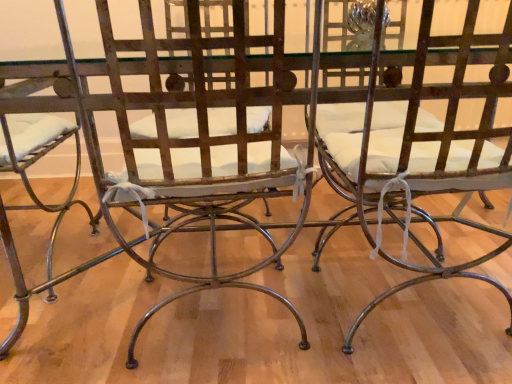
Find the location of a particular element. This screenshot has width=512, height=384. rustic wrought iron chair at center is located at coordinates (421, 146).

The width and height of the screenshot is (512, 384). Describe the element at coordinates (421, 146) in the screenshot. I see `rustic wrought iron chair at center` at that location.

Find the location of `rustic wrought iron chair at center`. rustic wrought iron chair at center is located at coordinates (421, 146).